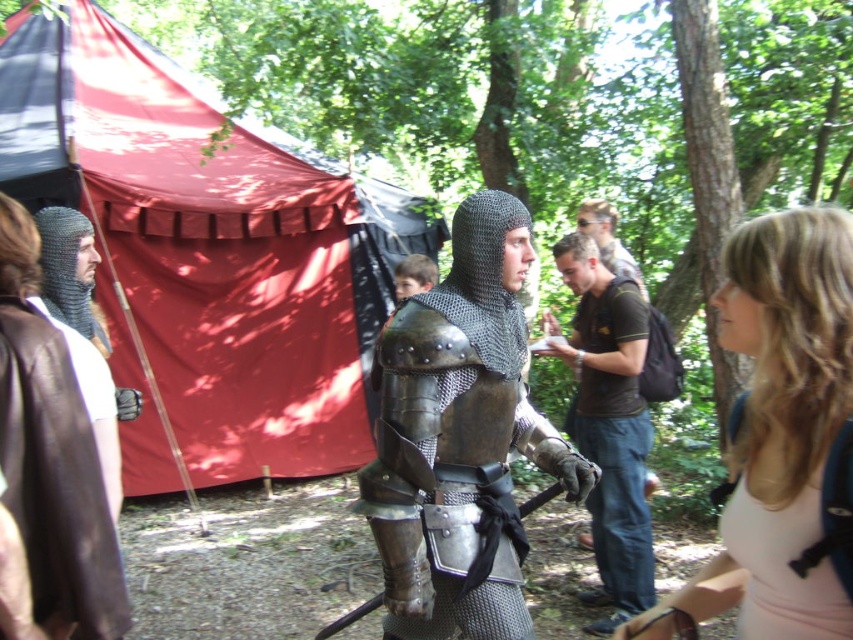
Is point (498, 509) behind point (622, 355)?

No, it is not.

Between metallic chainmail armor at center and brown leather shirt at center, which one has less height?

Standing shorter between the two is metallic chainmail armor at center.

Does point (468, 534) come behind point (583, 284)?

No, it is not.

The image size is (853, 640). In order to click on metallic chainmail armor at center in this screenshot , I will do `click(460, 440)`.

Is brown leather shirt at center shorter than pink fabric backpack at lower right?

Incorrect, brown leather shirt at center's height does not fall short of pink fabric backpack at lower right's.

Is brown leather shirt at center thinner than pink fabric backpack at lower right?

No, brown leather shirt at center is not thinner than pink fabric backpack at lower right.

Where is `brown leather shirt at center`? The image size is (853, 640). brown leather shirt at center is located at coordinates (608, 424).

Which is below, brown leather cape at left or pink fabric backpack at lower right?

Positioned lower is pink fabric backpack at lower right.

Which is in front, point (0, 410) or point (846, 627)?

Point (846, 627)

Find the location of a particular element. brown leather cape at left is located at coordinates (56, 480).